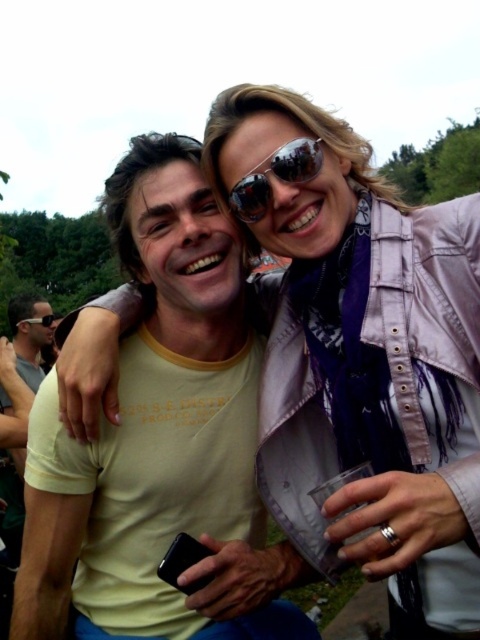
Can you confirm if yellow cotton t-shirt at center is positioned to the left of black reflective sunglasses at upper center?

Incorrect, yellow cotton t-shirt at center is not on the left side of black reflective sunglasses at upper center.

Based on the photo, can you confirm if yellow cotton t-shirt at center is positioned to the right of black reflective sunglasses at upper center?

Yes, yellow cotton t-shirt at center is to the right of black reflective sunglasses at upper center.

Identify the location of yellow cotton t-shirt at center. The width and height of the screenshot is (480, 640). (160, 440).

What do you see at coordinates (29, 333) in the screenshot? I see `matte black sunglasses at upper left` at bounding box center [29, 333].

Which is in front, point (47, 320) or point (56, 316)?

Positioned in front is point (47, 320).

Where is `matte black sunglasses at upper left`? matte black sunglasses at upper left is located at coordinates (29, 333).

What are the coordinates of `sunglasses at center` in the screenshot? It's located at (275, 177).

Does sunglasses at center have a greater height compared to matte black sunglasses at upper left?

In fact, sunglasses at center may be shorter than matte black sunglasses at upper left.

Who is more distant from viewer, (310,164) or (13,344)?

The point (13,344) is more distant.

The height and width of the screenshot is (640, 480). Identify the location of sunglasses at center. (275, 177).